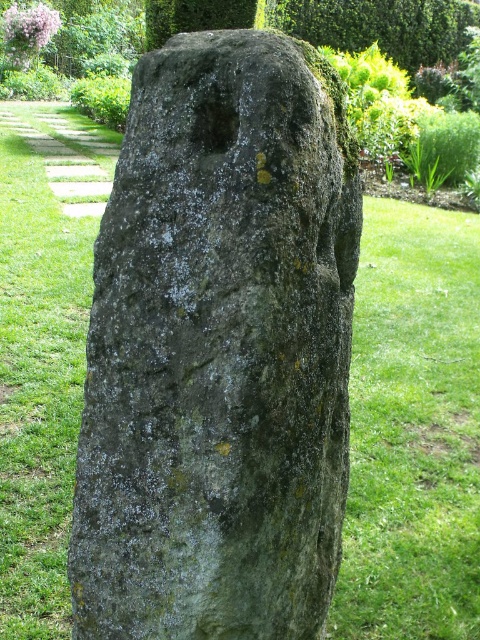
Question: Does green mossy stone at center appear on the right side of green leafy hedge at upper center?

Choices:
 (A) yes
 (B) no

Answer: (B)

Question: Among these points, which one is nearest to the camera?

Choices:
 (A) (175, 36)
 (B) (397, 4)

Answer: (A)

Question: Which of the following is the closest to the observer?

Choices:
 (A) (211, 355)
 (B) (408, 32)

Answer: (A)

Question: Is green mossy stone at center above green leafy hedge at upper center?

Choices:
 (A) yes
 (B) no

Answer: (B)

Question: Can you confirm if green mossy stone at center is smaller than green leafy hedge at upper center?

Choices:
 (A) no
 (B) yes

Answer: (B)